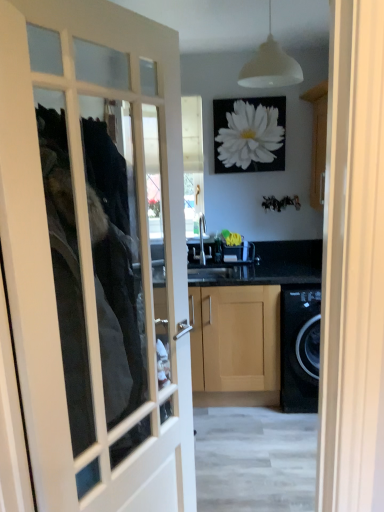
Question: From the image's perspective, is white glass door at center over white matte flower at upper center?

Choices:
 (A) no
 (B) yes

Answer: (A)

Question: Is white glass door at center located outside white matte flower at upper center?

Choices:
 (A) no
 (B) yes

Answer: (B)

Question: Does white glass door at center have a greater height compared to white matte flower at upper center?

Choices:
 (A) yes
 (B) no

Answer: (A)

Question: Is white glass door at center touching white matte flower at upper center?

Choices:
 (A) no
 (B) yes

Answer: (A)

Question: Could you tell me if white glass door at center is facing white matte flower at upper center?

Choices:
 (A) yes
 (B) no

Answer: (B)

Question: Considering the positions of point (236, 102) and point (273, 384), is point (236, 102) closer or farther from the camera than point (273, 384)?

Choices:
 (A) farther
 (B) closer

Answer: (A)

Question: Based on their sizes in the image, would you say white matte flower at upper center is bigger or smaller than light wood/finished cabinet at center?

Choices:
 (A) big
 (B) small

Answer: (B)

Question: Considering their positions, is white matte flower at upper center located in front of or behind light wood/finished cabinet at center?

Choices:
 (A) behind
 (B) front

Answer: (A)

Question: From a real-world perspective, is white matte flower at upper center above or below light wood/finished cabinet at center?

Choices:
 (A) above
 (B) below

Answer: (A)

Question: From the image's perspective, is light wood/finished cabinet at center located above or below white matte light fixture at upper center?

Choices:
 (A) above
 (B) below

Answer: (B)

Question: From a real-world perspective, is light wood/finished cabinet at center physically located above or below white matte light fixture at upper center?

Choices:
 (A) below
 (B) above

Answer: (A)

Question: In the image, is light wood/finished cabinet at center on the left side or the right side of white matte light fixture at upper center?

Choices:
 (A) left
 (B) right

Answer: (A)

Question: Is light wood/finished cabinet at center wider or thinner than white matte light fixture at upper center?

Choices:
 (A) thin
 (B) wide

Answer: (B)

Question: Would you say white matte flower at upper center is to the left or to the right of white glass door at center in the picture?

Choices:
 (A) left
 (B) right

Answer: (B)

Question: Considering the positions of point (278, 128) and point (43, 250), is point (278, 128) closer or farther from the camera than point (43, 250)?

Choices:
 (A) closer
 (B) farther

Answer: (B)